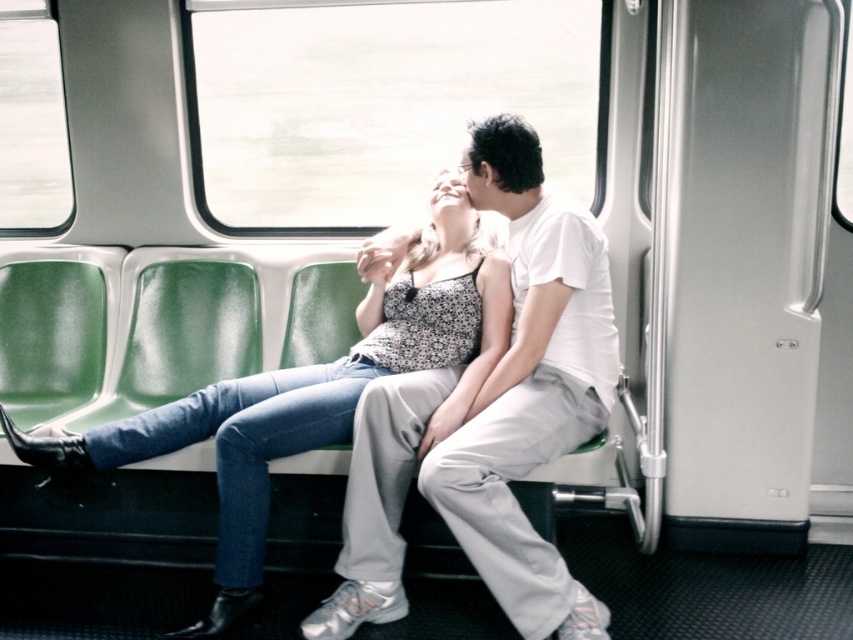
You are a photographer taking a photo of the white cotton shirt at center and the denim jeans at center from the front of the train. Which object will appear larger in your photo?

The white cotton shirt at center is closer to the viewer than denim jeans at center, so it will appear larger in the photo.

You are a passenger on the train and want to place a 10 inch long book between the white cotton shirt at center and the denim jeans at center. Can you fit the book there?

The distance between the white cotton shirt at center and the denim jeans at center is 9.64 inches, so the book is slightly longer than the available space. It won

You are sitting on a train and want to move from point A to point B. The coordinates of point A are point (519, 253) and point B are point (450, 426). Can you walk directly from point A to point B without moving around any obstacles?

Point (519, 253) is behind point (450, 426), so you cannot walk directly from point A to point B without moving around point (450, 426).